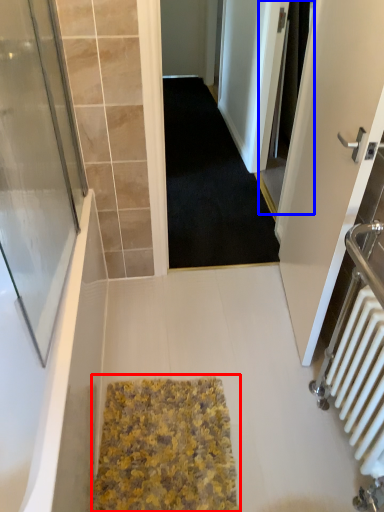
Question: Among these objects, which one is farthest to the camera, bath mat (highlighted by a red box) or screen door (highlighted by a blue box)?

Choices:
 (A) bath mat
 (B) screen door

Answer: (B)